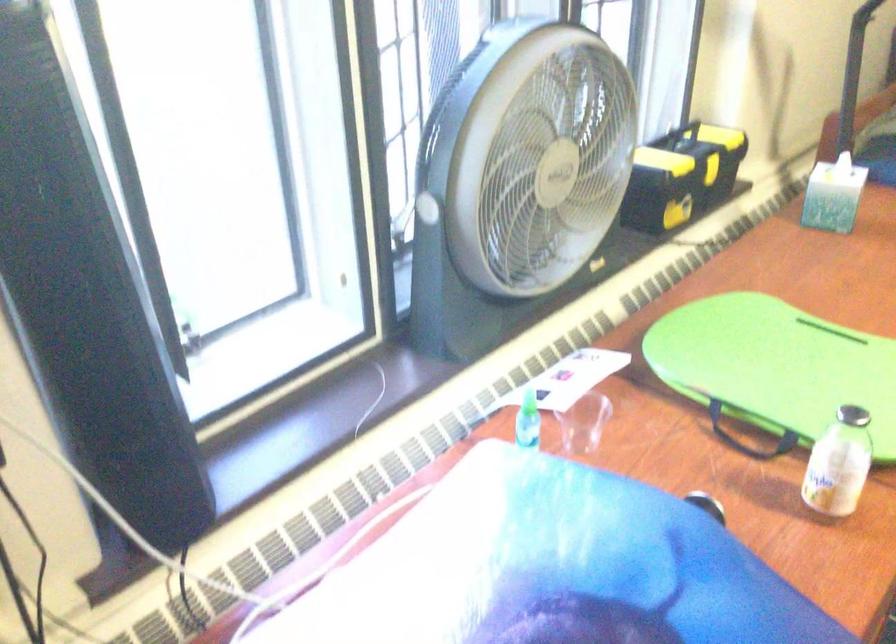
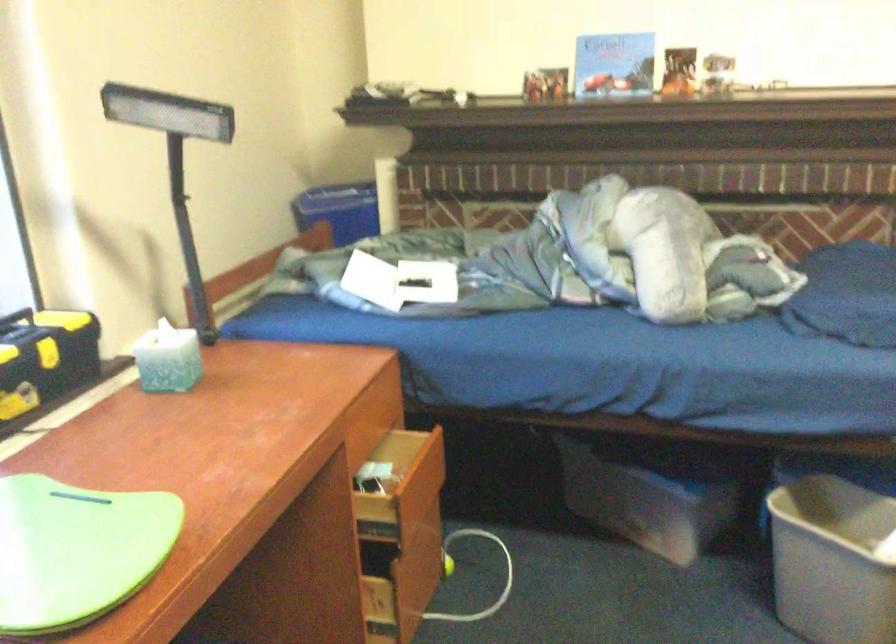
Question: In a continuous first-person perspective shot, in which direction is the camera moving?

Choices:
 (A) Left
 (B) Right
 (C) Forward
 (D) Backward

Answer: (B)